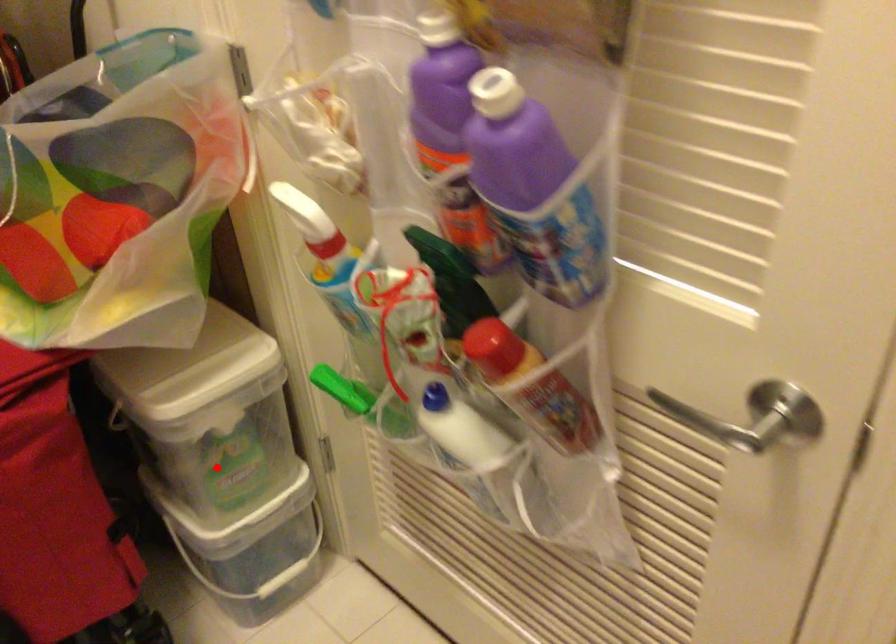
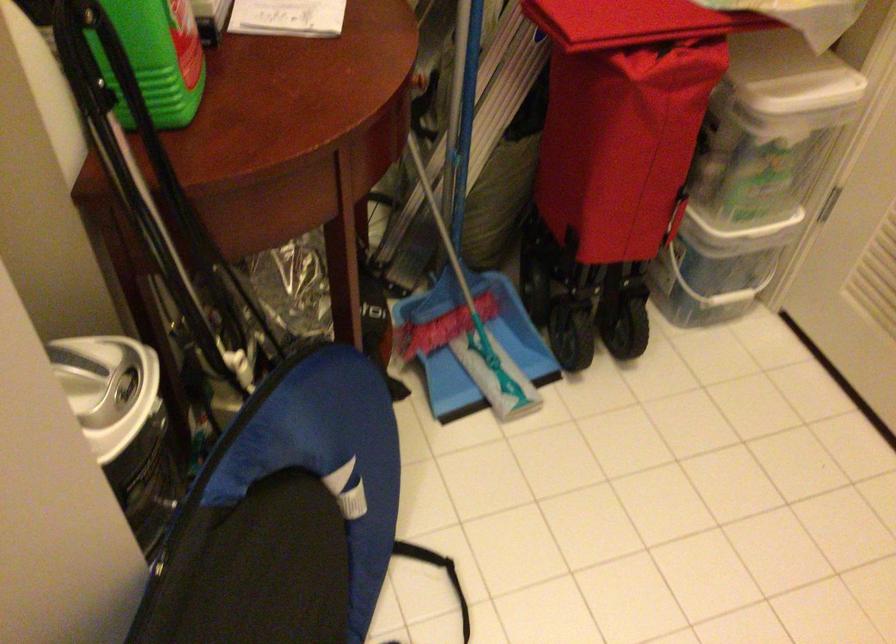
The point at the highlighted location is marked in the first image. Where is the corresponding point in the second image?

(752, 174)